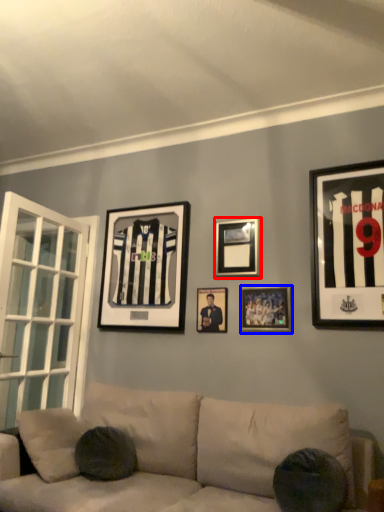
Question: Which of the following is the farthest to the observer, picture frame (highlighted by a red box) or picture frame (highlighted by a blue box)?

Choices:
 (A) picture frame
 (B) picture frame

Answer: (A)